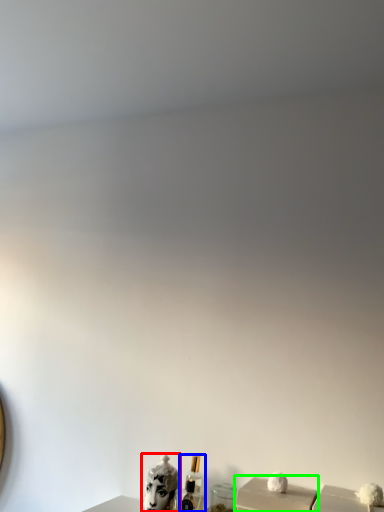
Question: Based on their relative distances, which object is nearer to animal (highlighted by a red box)? Choose from perfume (highlighted by a blue box) and box (highlighted by a green box).

Choices:
 (A) perfume
 (B) box

Answer: (A)